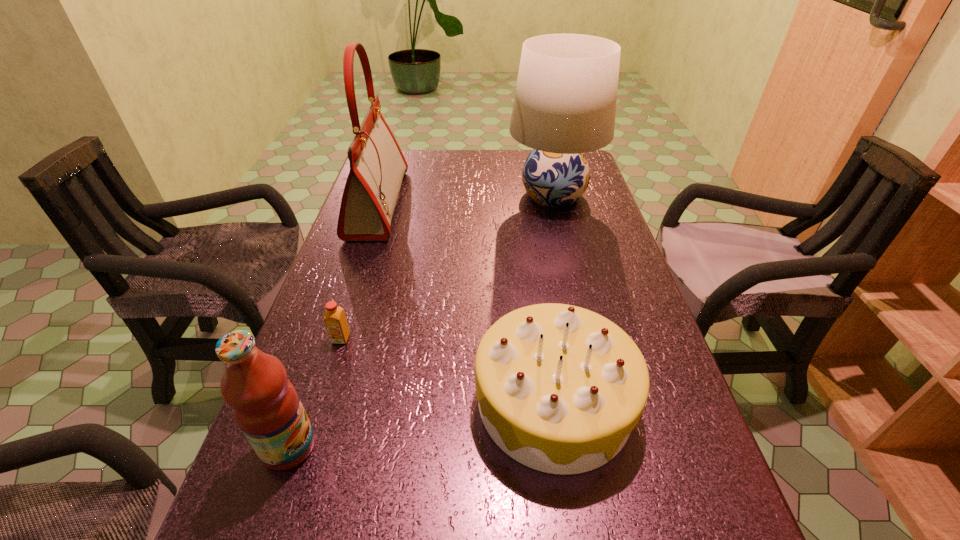
Locate an element on the screen. This screenshot has height=540, width=960. handbag is located at coordinates (377, 165).

You are a GUI agent. You are given a task and a screenshot of the screen. Output one action in this format:
    pyautogui.click(x=<x>, y=<y>)
    Task: Click on the lampshade
    The image size is (960, 540).
    Given the screenshot: What is the action you would take?
    pyautogui.click(x=565, y=101)

Image resolution: width=960 pixels, height=540 pixels. I want to click on the third shortest object, so click(265, 404).

Locate an element on the screen. The image size is (960, 540). birthday cake is located at coordinates (560, 388).

Where is `the shortest object`? The height and width of the screenshot is (540, 960). the shortest object is located at coordinates (335, 320).

Find the location of `vacant space located on the back of the handbag`. vacant space located on the back of the handbag is located at coordinates (394, 157).

Identify the location of blank space located 0.390m on the front-facing side of the lampshade. (383, 195).

You are a GUI agent. You are given a task and a screenshot of the screen. Output one action in this format:
    pyautogui.click(x=<x>, y=<y>)
    Task: Click on the free location located 0.110m on the front-facing side of the lampshade
    Image resolution: width=960 pixels, height=540 pixels.
    Given the screenshot: What is the action you would take?
    pyautogui.click(x=471, y=195)

Locate an element on the screen. vacant space located on the front-facing side of the lampshade is located at coordinates (485, 195).

Locate an element on the screen. The height and width of the screenshot is (540, 960). free location located 0.380m on the front label of the fruit juice is located at coordinates (536, 447).